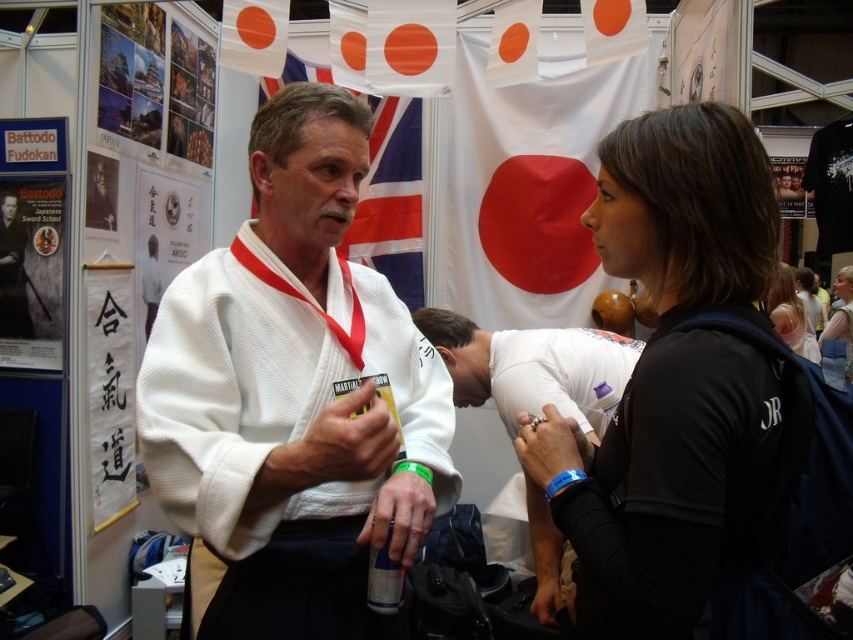
Question: Which point is farther to the camera?

Choices:
 (A) (262, 477)
 (B) (784, 269)
 (C) (581, 372)

Answer: (B)

Question: In this image, where is black matte jacket at center located relative to white matte kimono at center?

Choices:
 (A) above
 (B) below

Answer: (A)

Question: Does white cotton kimono at center appear on the left side of blue fabric shirt at upper right?

Choices:
 (A) yes
 (B) no

Answer: (A)

Question: Which object is the farthest from the blue fabric shirt at upper right?

Choices:
 (A) white cotton kimono at center
 (B) black matte jacket at center
 (C) white matte kimono at center
 (D) black fabric shirt at right

Answer: (A)

Question: Which object appears farthest from the camera in this image?

Choices:
 (A) blue fabric shirt at upper right
 (B) black matte jacket at center

Answer: (A)

Question: Can you confirm if white matte kimono at center is bigger than black fabric shirt at right?

Choices:
 (A) no
 (B) yes

Answer: (B)